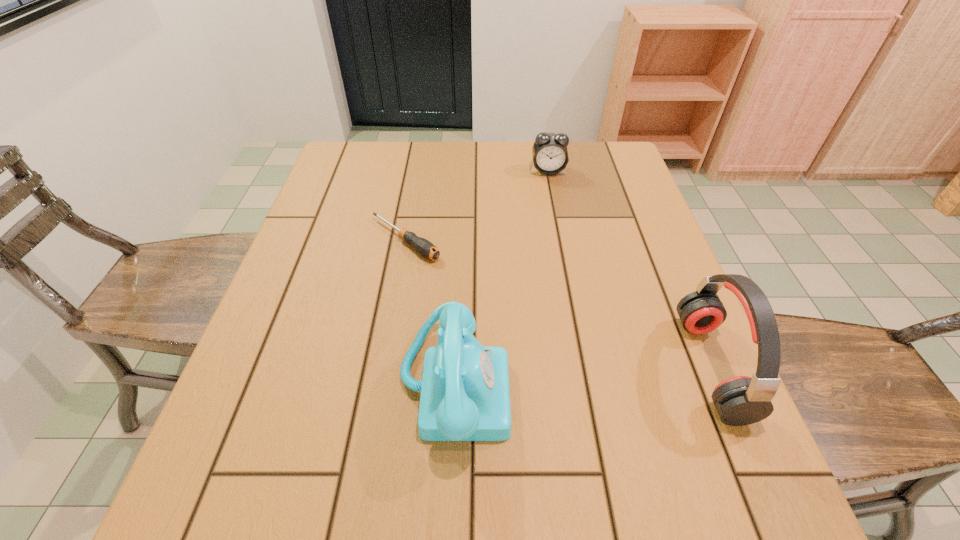
Identify the location of object present at the right edge. Image resolution: width=960 pixels, height=540 pixels. (741, 400).

Where is `object positioned at the near right corner`? This screenshot has height=540, width=960. object positioned at the near right corner is located at coordinates (741, 400).

The width and height of the screenshot is (960, 540). In the image, there is a desktop. In order to click on vacant space at the far edge in this screenshot , I will do `click(556, 184)`.

Locate an element on the screen. vacant region at the near edge of the desktop is located at coordinates (542, 434).

The image size is (960, 540). I want to click on vacant space at the left edge, so click(x=270, y=336).

In the image, there is a desktop. Where is `vacant space at the right edge`? vacant space at the right edge is located at coordinates (631, 362).

Locate an element on the screen. blank space at the far left corner is located at coordinates (332, 176).

You are a GUI agent. You are given a task and a screenshot of the screen. Output one action in this format:
    pyautogui.click(x=<x>, y=<y>)
    Task: Click on the vacant point at the near left corner
    The width and height of the screenshot is (960, 540).
    Given the screenshot: What is the action you would take?
    point(294,405)

This screenshot has width=960, height=540. Identify the location of vacant space that's between the second object from right to left and the third shortest object. pyautogui.click(x=501, y=278).

You are a GUI agent. You are given a task and a screenshot of the screen. Output one action in this format:
    pyautogui.click(x=<x>, y=<y>)
    Task: Click on the unoccupied position between the shortest object and the tallest object
    This screenshot has height=540, width=960.
    Given the screenshot: What is the action you would take?
    pyautogui.click(x=558, y=303)